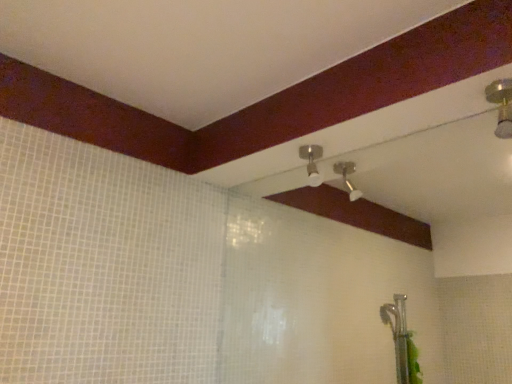
Question: Is gold metallic shower head at upper right, which is counted as the 2th shower, starting from the back, touching matte silver shower head at center, which ranks as the first shower in left-to-right order?

Choices:
 (A) no
 (B) yes

Answer: (A)

Question: Is matte silver shower head at center, positioned as the second shower in front-to-back order, surrounded by gold metallic shower head at upper right, the second shower positioned from the left?

Choices:
 (A) yes
 (B) no

Answer: (B)

Question: Is gold metallic shower head at upper right, which is counted as the 2th shower, starting from the back, completely or partially outside of matte silver shower head at center, acting as the second shower starting from the right?

Choices:
 (A) no
 (B) yes

Answer: (B)

Question: Considering the relative sizes of gold metallic shower head at upper right, the second shower positioned from the left, and matte silver shower head at center, acting as the second shower starting from the right, in the image provided, is gold metallic shower head at upper right, the second shower positioned from the left, shorter than matte silver shower head at center, acting as the second shower starting from the right,?

Choices:
 (A) yes
 (B) no

Answer: (A)

Question: Is gold metallic shower head at upper right, the second shower positioned from the left, smaller than matte silver shower head at center, acting as the second shower starting from the right?

Choices:
 (A) no
 (B) yes

Answer: (B)

Question: Can you confirm if gold metallic shower head at upper right, the second shower positioned from the left, is positioned to the left of matte silver shower head at center, which is the first shower from back to front?

Choices:
 (A) no
 (B) yes

Answer: (A)

Question: Is matte silver shower head at center, acting as the second shower starting from the right, positioned far away from gold metallic shower head at upper right, the 1th shower in the right-to-left sequence?

Choices:
 (A) no
 (B) yes

Answer: (A)

Question: Is matte silver shower head at center, acting as the second shower starting from the right, taller than gold metallic shower head at upper right, the second shower positioned from the left?

Choices:
 (A) yes
 (B) no

Answer: (A)

Question: From a real-world perspective, is matte silver shower head at center, positioned as the second shower in front-to-back order, positioned under gold metallic shower head at upper right, placed as the first shower when sorted from front to back, based on gravity?

Choices:
 (A) yes
 (B) no

Answer: (A)

Question: Does matte silver shower head at center, positioned as the second shower in front-to-back order, have a lesser width compared to gold metallic shower head at upper right, placed as the first shower when sorted from front to back?

Choices:
 (A) yes
 (B) no

Answer: (B)

Question: Can you confirm if matte silver shower head at center, acting as the second shower starting from the right, is positioned to the right of gold metallic shower head at upper right, the second shower positioned from the left?

Choices:
 (A) no
 (B) yes

Answer: (A)

Question: Is matte silver shower head at center, positioned as the second shower in front-to-back order, wider than gold metallic shower head at upper right, the 1th shower in the right-to-left sequence?

Choices:
 (A) no
 (B) yes

Answer: (B)

Question: Is matte silver shower head at center, acting as the second shower starting from the right, situated inside gold metallic shower head at upper right, the 1th shower in the right-to-left sequence, or outside?

Choices:
 (A) outside
 (B) inside

Answer: (A)